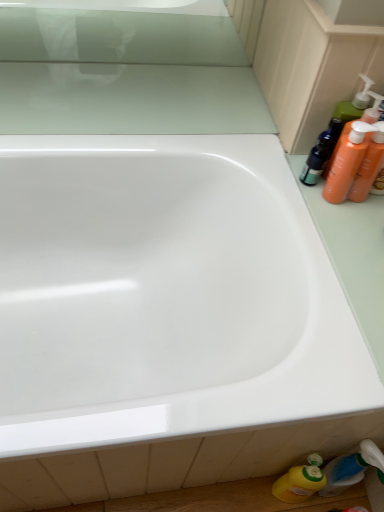
The width and height of the screenshot is (384, 512). Find the location of `space that is in front of orange plastic bottles at upper right, marked as the second cleaning product in a left-to-right arrangement`. space that is in front of orange plastic bottles at upper right, marked as the second cleaning product in a left-to-right arrangement is located at coordinates (341, 243).